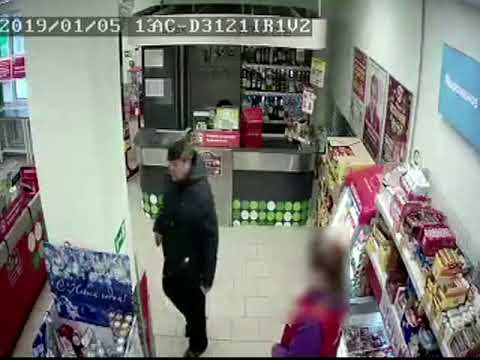
Where is `convenience store floor`? Image resolution: width=480 pixels, height=360 pixels. convenience store floor is located at coordinates (35, 325), (164, 320), (171, 353), (257, 350), (277, 289), (232, 284), (234, 248), (284, 253), (154, 253).